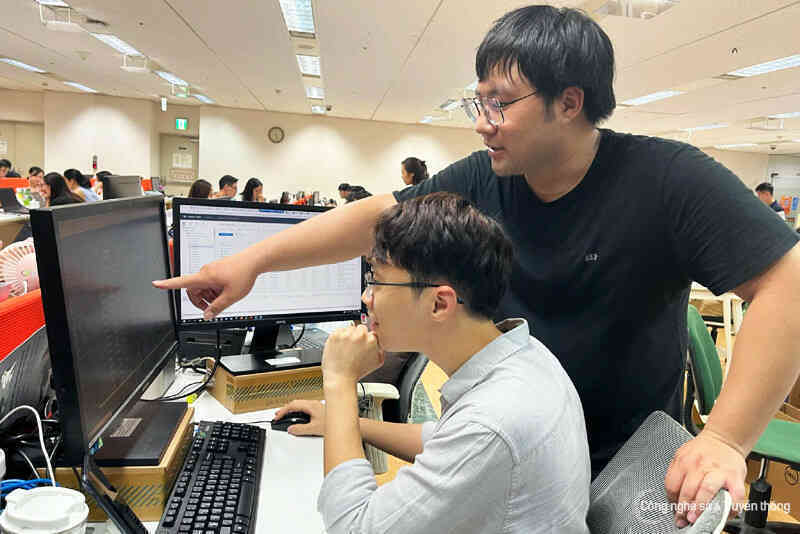
Identify the location of keyboard. Image resolution: width=800 pixels, height=534 pixels. (222, 469).